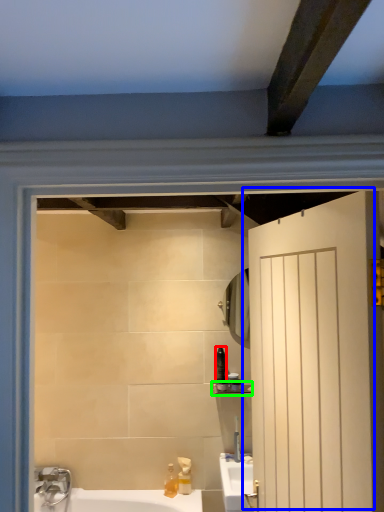
Question: Considering the real-world distances, which object is farthest from toiletry (highlighted by a red box)? door (highlighted by a blue box) or balustrade (highlighted by a green box)?

Choices:
 (A) door
 (B) balustrade

Answer: (A)